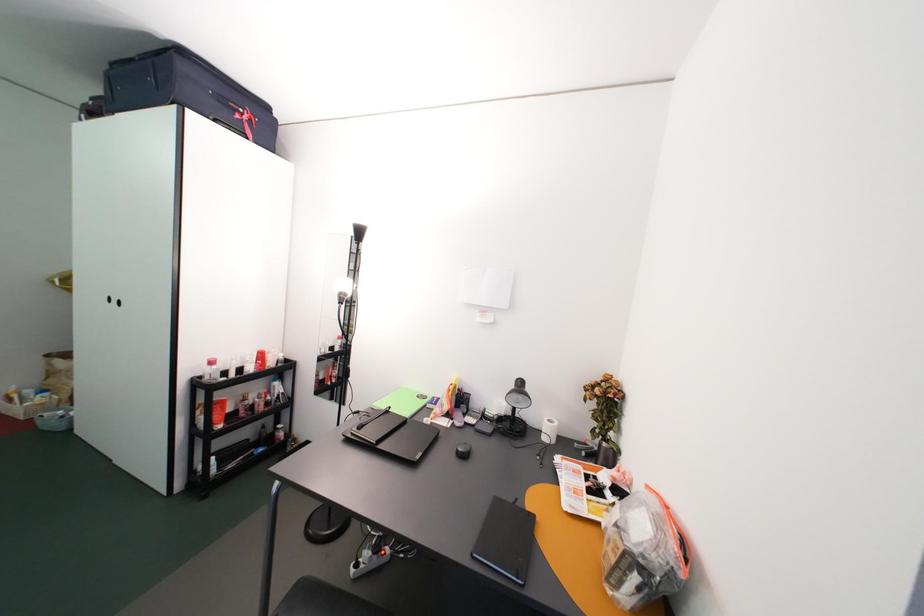
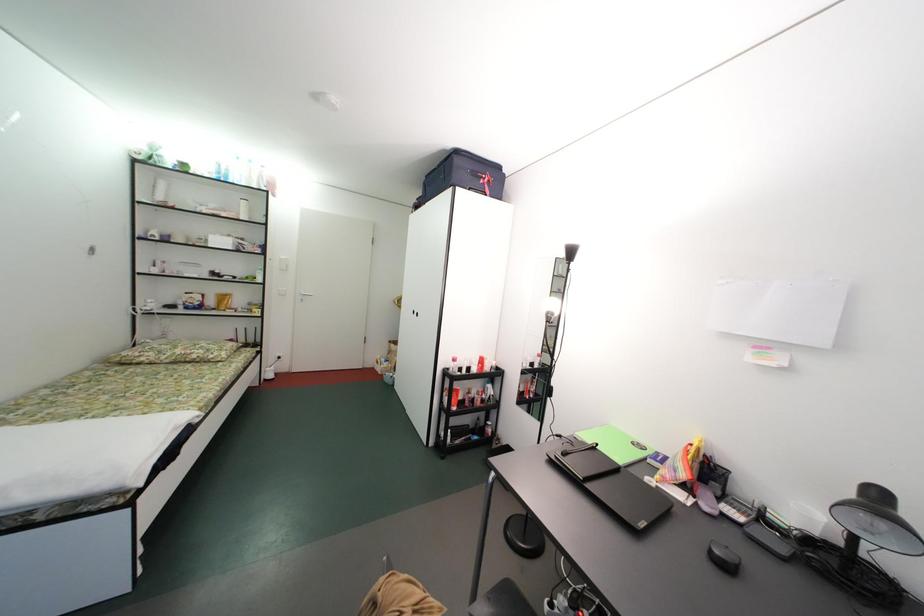
Question: How did the camera likely rotate?

Choices:
 (A) Left
 (B) Right
 (C) Up
 (D) Down

Answer: (A)